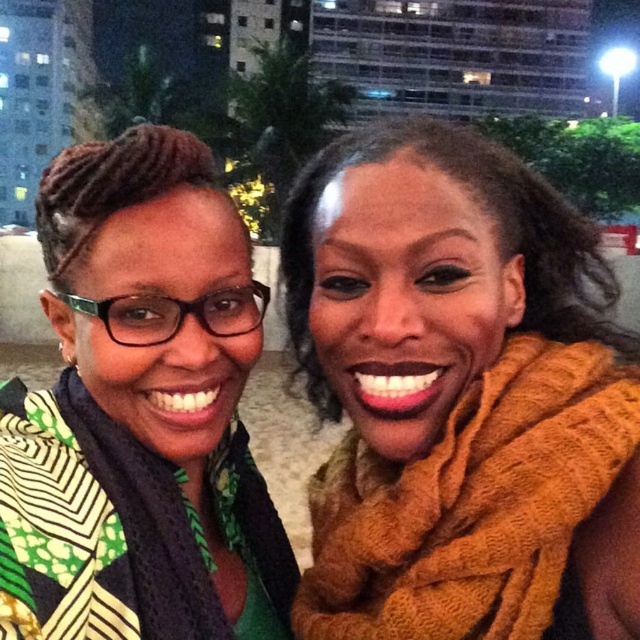
Question: Can you confirm if green printed fabric at left is positioned to the left of orange fuzzy scarf at right?

Choices:
 (A) yes
 (B) no

Answer: (A)

Question: Does green printed fabric at left appear on the right side of orange fuzzy scarf at right?

Choices:
 (A) yes
 (B) no

Answer: (B)

Question: Can you confirm if green printed fabric at left is positioned to the right of orange fuzzy scarf at right?

Choices:
 (A) no
 (B) yes

Answer: (A)

Question: Which object is closer to the camera taking this photo?

Choices:
 (A) green printed fabric at left
 (B) orange fuzzy scarf at right

Answer: (A)